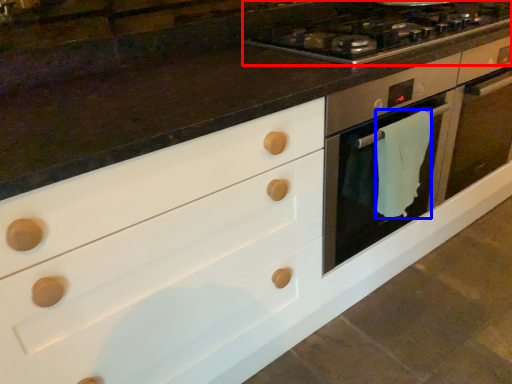
Question: Which object appears farthest to the camera in this image, gas stove (highlighted by a red box) or material (highlighted by a blue box)?

Choices:
 (A) gas stove
 (B) material

Answer: (B)